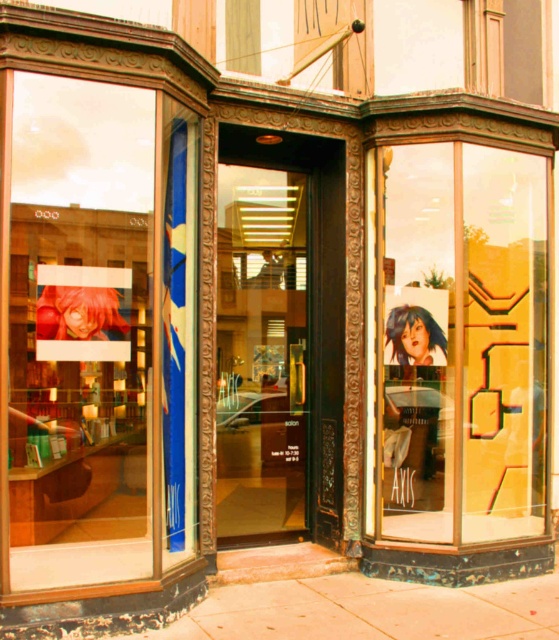
Question: Which point is farther to the camera?

Choices:
 (A) (120, 332)
 (B) (130, 195)
 (C) (306, 404)
 (D) (471, 417)

Answer: (A)

Question: Does blue hair doll at center appear under smooth red hair at left?

Choices:
 (A) yes
 (B) no

Answer: (A)

Question: In this image, where is transparent glass door at right located relative to smooth blue hair at upper right?

Choices:
 (A) below
 (B) above

Answer: (A)

Question: Which of these objects is positioned farthest from the smooth red hair at left?

Choices:
 (A) transparent glass door at center
 (B) smooth blue hair at upper right

Answer: (B)

Question: Is transparent glass door at right above smooth red hair at left?

Choices:
 (A) no
 (B) yes

Answer: (A)

Question: Which object is positioned closest to the transparent glass door at center?

Choices:
 (A) smooth red hair at left
 (B) smooth blue hair at upper right
 (C) matte glass window at left

Answer: (C)